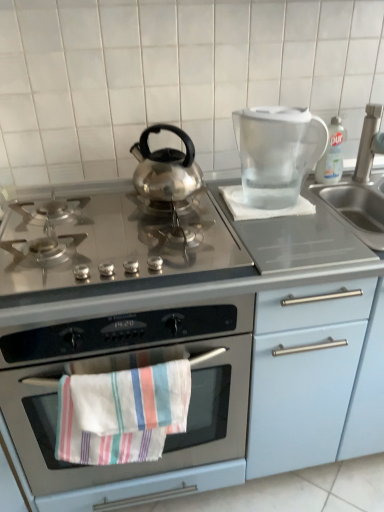
Question: Should I look upward or downward to see transparent plastic pitcher at upper right?

Choices:
 (A) down
 (B) up

Answer: (B)

Question: Is stainless steel gas stove at center closer to camera compared to clear plastic bottle at upper right?

Choices:
 (A) yes
 (B) no

Answer: (A)

Question: Does stainless steel gas stove at center have a greater width compared to clear plastic bottle at upper right?

Choices:
 (A) yes
 (B) no

Answer: (A)

Question: Could you tell me if stainless steel gas stove at center is turned towards clear plastic bottle at upper right?

Choices:
 (A) yes
 (B) no

Answer: (B)

Question: Does stainless steel gas stove at center contain clear plastic bottle at upper right?

Choices:
 (A) no
 (B) yes

Answer: (A)

Question: Does stainless steel gas stove at center have a lesser height compared to clear plastic bottle at upper right?

Choices:
 (A) no
 (B) yes

Answer: (B)

Question: Is stainless steel gas stove at center bigger than clear plastic bottle at upper right?

Choices:
 (A) yes
 (B) no

Answer: (A)

Question: Could you tell me if clear plastic bottle at upper right is facing stainless steel gas stove at center?

Choices:
 (A) no
 (B) yes

Answer: (A)

Question: Considering the relative sizes of clear plastic bottle at upper right and stainless steel gas stove at center in the image provided, is clear plastic bottle at upper right wider than stainless steel gas stove at center?

Choices:
 (A) yes
 (B) no

Answer: (B)

Question: From a real-world perspective, is clear plastic bottle at upper right over stainless steel gas stove at center?

Choices:
 (A) no
 (B) yes

Answer: (B)

Question: Is clear plastic bottle at upper right shorter than stainless steel gas stove at center?

Choices:
 (A) yes
 (B) no

Answer: (B)

Question: Is clear plastic bottle at upper right turned away from stainless steel gas stove at center?

Choices:
 (A) yes
 (B) no

Answer: (B)

Question: From the image's perspective, is clear plastic bottle at upper right located above stainless steel gas stove at center?

Choices:
 (A) yes
 (B) no

Answer: (A)

Question: Is transparent plastic pitcher at upper right looking in the opposite direction of satin nickel faucet at right?

Choices:
 (A) no
 (B) yes

Answer: (B)